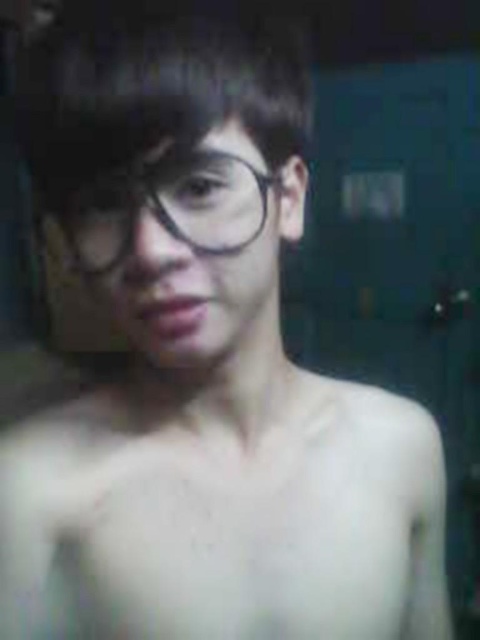
Question: Does skinny white skin at center appear on the left side of matte black glasses at center?

Choices:
 (A) yes
 (B) no

Answer: (B)

Question: Is matte black glasses at center positioned in front of clear plastic glasses at center?

Choices:
 (A) no
 (B) yes

Answer: (A)

Question: Which object appears closest to the camera in this image?

Choices:
 (A) clear plastic glasses at center
 (B) matte black glasses at center
 (C) skinny white skin at center

Answer: (A)

Question: Which point is closer to the camera taking this photo?

Choices:
 (A) (92, 412)
 (B) (181, 285)

Answer: (B)

Question: Which point is farther to the camera?

Choices:
 (A) skinny white skin at center
 (B) clear plastic glasses at center

Answer: (A)

Question: Can you confirm if skinny white skin at center is wider than matte black glasses at center?

Choices:
 (A) yes
 (B) no

Answer: (A)